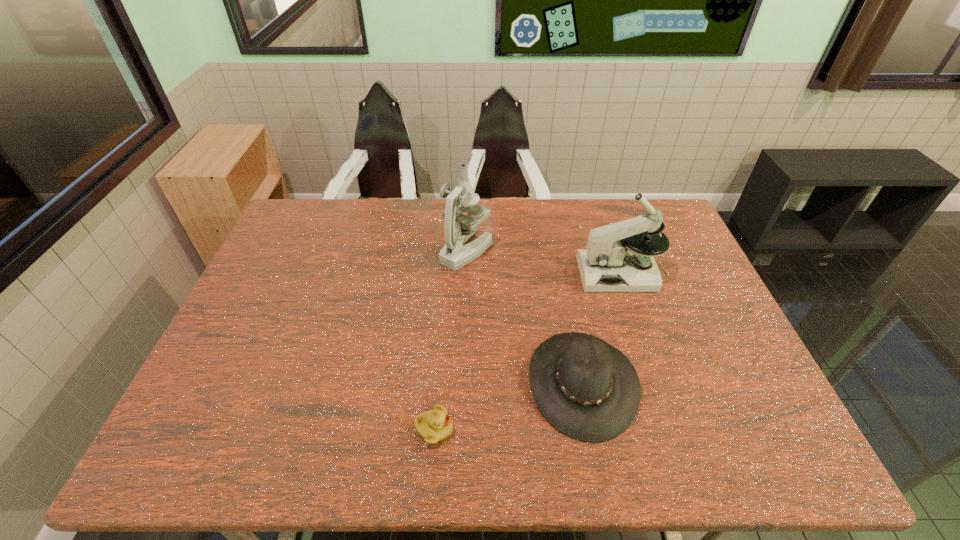
At what (x,y) coordinates should I click in order to perform the action: click on free spot between the shortest object and the left microscope. Please return your answer as a coordinate pair (x, y). Image resolution: width=960 pixels, height=540 pixels. Looking at the image, I should click on (450, 340).

This screenshot has height=540, width=960. I want to click on object that stands as the closest to the left microscope, so click(x=587, y=389).

Locate an element on the screen. The height and width of the screenshot is (540, 960). the second closest object to the duckling is located at coordinates (458, 228).